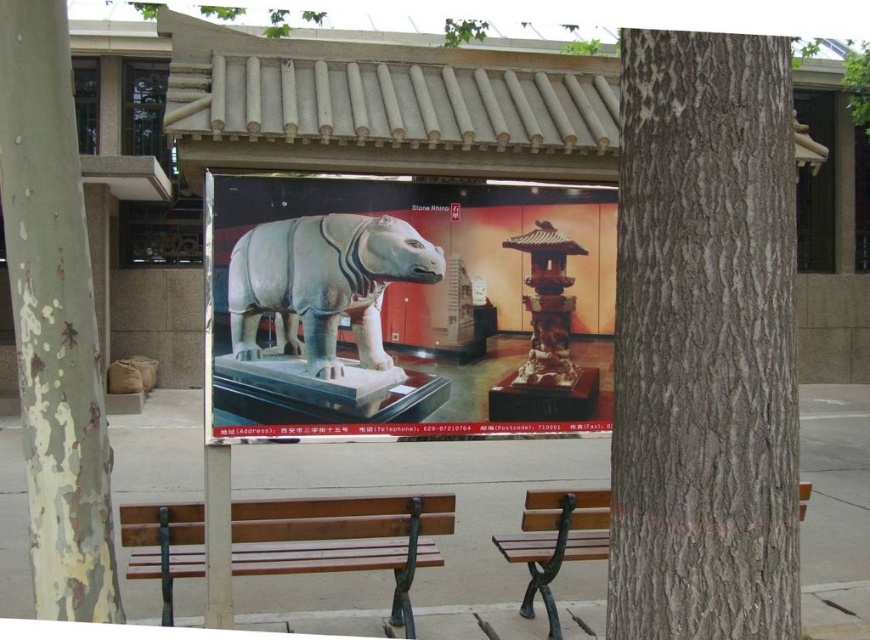
You are a visitor at the museum and want to take a photo of the white stone rhino at center and the polished bronze pagoda at center. Which object should you focus on first if you want to capture both in a single frame without moving the camera?

The white stone rhino at center is shorter than the polished bronze pagoda at center, so you should focus on the polished bronze pagoda at center first to ensure both are in frame.

Based on the photo, you are a visitor sitting on the brown wooden bench at center. You want to move to the gray rough bark tree at right to touch its bark. Is the tree within arm s reach from the bench?

The gray rough bark tree at right is positioned on the right side of brown wooden bench at center, so it is close enough to be within arm s reach.

You are standing at the camera position and want to reach point (788, 541). Is the distance more than 2 meters?

The distance between the camera and point (788, 541) is 2.62 meters, so yes, the distance is more than 2 meters.